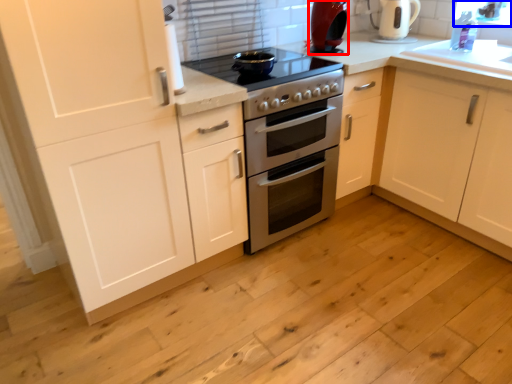
Question: Which point is further to the camera, kitchen appliance (highlighted by a red box) or window screen (highlighted by a blue box)?

Choices:
 (A) kitchen appliance
 (B) window screen

Answer: (B)